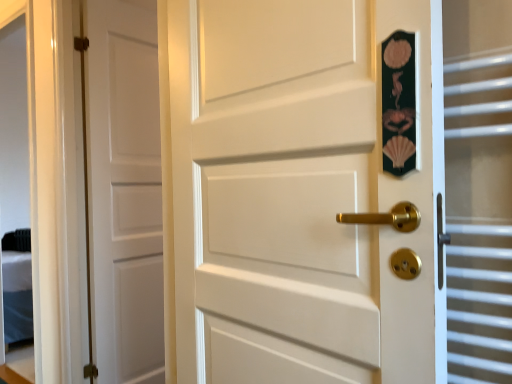
Question: Can you confirm if clear glass door at right is bigger than white matte door at center, which ranks as the first door in front-to-back order?

Choices:
 (A) no
 (B) yes

Answer: (A)

Question: Is clear glass door at right wider than white matte door at center, which ranks as the first door in front-to-back order?

Choices:
 (A) yes
 (B) no

Answer: (B)

Question: From a real-world perspective, is clear glass door at right over white matte door at center, which ranks as the first door in front-to-back order?

Choices:
 (A) no
 (B) yes

Answer: (A)

Question: Considering the relative sizes of clear glass door at right and white matte door at center, the 2th door positioned from the left, in the image provided, is clear glass door at right shorter than white matte door at center, the 2th door positioned from the left,?

Choices:
 (A) yes
 (B) no

Answer: (A)

Question: Considering the relative sizes of clear glass door at right and white matte door at center, the 1th door when ordered from right to left, in the image provided, is clear glass door at right taller than white matte door at center, the 1th door when ordered from right to left,?

Choices:
 (A) no
 (B) yes

Answer: (A)

Question: Considering the positions of white matte door at center, the 1th door when ordered from right to left, and clear glass door at right in the image, is white matte door at center, the 1th door when ordered from right to left, wider or thinner than clear glass door at right?

Choices:
 (A) wide
 (B) thin

Answer: (A)

Question: In terms of size, does white matte door at center, the 2th door positioned from the left, appear bigger or smaller than clear glass door at right?

Choices:
 (A) big
 (B) small

Answer: (A)

Question: From a real-world perspective, is white matte door at center, the 1th door when ordered from right to left, positioned above or below clear glass door at right?

Choices:
 (A) above
 (B) below

Answer: (A)

Question: Considering their positions, is white matte door at center, the 1th door when ordered from right to left, located in front of or behind clear glass door at right?

Choices:
 (A) behind
 (B) front

Answer: (B)

Question: From a real-world perspective, is white matte door at left, which is counted as the 1th door, starting from the left, physically located above or below clear glass door at right?

Choices:
 (A) above
 (B) below

Answer: (A)

Question: In terms of height, does white matte door at left, which is the 2th door from right to left, look taller or shorter compared to clear glass door at right?

Choices:
 (A) short
 (B) tall

Answer: (B)

Question: Looking at the image, does white matte door at left, which is counted as the 1th door, starting from the left, seem bigger or smaller compared to clear glass door at right?

Choices:
 (A) small
 (B) big

Answer: (B)

Question: In the image, is white matte door at left, which ranks as the second door in front-to-back order, positioned in front of or behind clear glass door at right?

Choices:
 (A) behind
 (B) front

Answer: (A)

Question: From a real-world perspective, is clear glass door at right physically located above or below white matte door at left, which ranks as the second door in front-to-back order?

Choices:
 (A) above
 (B) below

Answer: (B)

Question: In terms of height, does clear glass door at right look taller or shorter compared to white matte door at left, which is the 2th door from right to left?

Choices:
 (A) tall
 (B) short

Answer: (B)